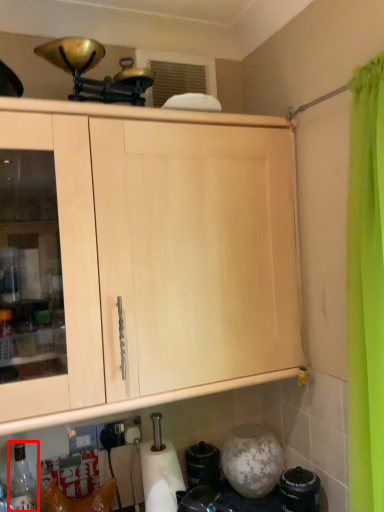
Question: In this image, where is bottle (annotated by the red box) located relative to paper towel?

Choices:
 (A) left
 (B) right

Answer: (A)